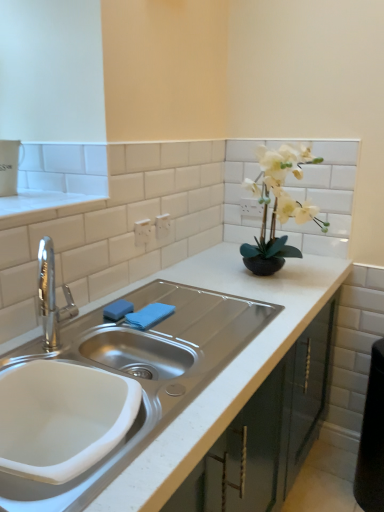
The image size is (384, 512). What do you see at coordinates (279, 207) in the screenshot?
I see `white matte vase at upper right` at bounding box center [279, 207].

Image resolution: width=384 pixels, height=512 pixels. What do you see at coordinates (149, 315) in the screenshot?
I see `blue fabric towel at sink` at bounding box center [149, 315].

Where is `white ceramic sink at lower left`? This screenshot has width=384, height=512. white ceramic sink at lower left is located at coordinates (62, 418).

Where is `white matte vase at upper right`? Image resolution: width=384 pixels, height=512 pixels. white matte vase at upper right is located at coordinates (279, 207).

Can you tell me how much blue sponge at sink and white ceramic sink at lower left differ in facing direction?

There is a 7-degree angle between the facing directions of blue sponge at sink and white ceramic sink at lower left.

Looking at this image, from the image's perspective, which is below, blue sponge at sink or white ceramic sink at lower left?

white ceramic sink at lower left appears lower in the image.

In the scene shown: Would you say blue sponge at sink is a long distance from white ceramic sink at lower left?

No, there isn't a large distance between blue sponge at sink and white ceramic sink at lower left.

Is blue sponge at sink not within white ceramic sink at lower left?

Indeed, blue sponge at sink is completely outside white ceramic sink at lower left.

Is blue fabric towel at sink in contact with white matte vase at upper right?

There is a gap between blue fabric towel at sink and white matte vase at upper right.

Who is smaller, blue fabric towel at sink or white matte vase at upper right?

blue fabric towel at sink is smaller.

Is blue fabric towel at sink situated inside white matte vase at upper right or outside?

blue fabric towel at sink is not inside white matte vase at upper right, it's outside.

Based on the photo, considering the relative positions of blue fabric towel at sink and white matte vase at upper right in the image provided, is blue fabric towel at sink to the right of white matte vase at upper right from the viewer's perspective?

In fact, blue fabric towel at sink is to the left of white matte vase at upper right.

From a real-world perspective, who is located higher, white matte countertop at center or white ceramic sink at lower left?

A: white matte countertop at center.

Locate an element on the screen. This screenshot has height=512, width=384. countertop above the white ceramic sink at lower left (from the image's perspective) is located at coordinates (224, 369).

Which is more to the left, white matte countertop at center or white ceramic sink at lower left?

From the viewer's perspective, white ceramic sink at lower left appears more on the left side.

Based on the photo, is white matte countertop at center looking in the opposite direction of white ceramic sink at lower left?

Yes, white matte countertop at center is facing away from white ceramic sink at lower left.

Is white matte vase at upper right with blue sponge at sink?

No, white matte vase at upper right is not beside blue sponge at sink.

The width and height of the screenshot is (384, 512). I want to click on houseplant that appears in front of the blue sponge at sink, so click(279, 207).

Measure the distance between white matte vase at upper right and blue sponge at sink.

white matte vase at upper right is 25.49 inches from blue sponge at sink.

Is white matte vase at upper right to the right of blue sponge at sink from the viewer's perspective?

Indeed, white matte vase at upper right is positioned on the right side of blue sponge at sink.

Can you tell me how much white matte vase at upper right and white matte countertop at center differ in facing direction?

They differ by 40.7 degrees in their facing directions.

This screenshot has height=512, width=384. In order to click on houseplant above the white matte countertop at center (from a real-world perspective) in this screenshot , I will do `click(279, 207)`.

Considering the relative positions of white matte vase at upper right and white matte countertop at center in the image provided, is white matte vase at upper right to the right of white matte countertop at center from the viewer's perspective?

Correct, you'll find white matte vase at upper right to the right of white matte countertop at center.

Would you say white matte vase at upper right contains white matte countertop at center?

No, white matte countertop at center is not surrounded by white matte vase at upper right.

Considering their positions, is blue sponge at sink located in front of or behind white matte vase at upper right?

blue sponge at sink is behind white matte vase at upper right.

Is blue sponge at sink shorter than white matte vase at upper right?

Yes, blue sponge at sink is shorter than white matte vase at upper right.

From a real-world perspective, which object stands above the other?

white matte vase at upper right, from a real-world perspective.

Can you confirm if white matte countertop at center is wider than blue sponge at sink?

Yes.

Can you tell me how much white matte countertop at center and blue sponge at sink differ in facing direction?

There is a 0.00199-degree angle between the facing directions of white matte countertop at center and blue sponge at sink.

From the image's perspective, is white matte countertop at center above blue sponge at sink?

No.

Identify the location of sink below the blue sponge at sink (from a real-world perspective). This screenshot has width=384, height=512. (62, 418).

You are a GUI agent. You are given a task and a screenshot of the screen. Output one action in this format:
    pyautogui.click(x=<x>, y=<y>)
    Task: Click on the towel bar that appears below the white matte vase at upper right (from the image's perspective)
    Image resolution: width=384 pixels, height=512 pixels.
    Given the screenshot: What is the action you would take?
    pyautogui.click(x=149, y=315)

Estimate the real-world distances between objects in this image. Which object is further from white ceramic sink at lower left, white matte countertop at center or white matte vase at upper right?

white matte vase at upper right is positioned further to the anchor white ceramic sink at lower left.

Looking at the image, which one is located further to white matte vase at upper right, blue fabric towel at sink or white ceramic sink at lower left?

white ceramic sink at lower left.

Which object lies further to the anchor point white matte countertop at center, white matte vase at upper right or blue fabric towel at sink?

blue fabric towel at sink lies further to white matte countertop at center than the other object.

Based on their spatial positions, is white matte vase at upper right or blue fabric towel at sink closer to blue sponge at sink?

The object closer to blue sponge at sink is blue fabric towel at sink.

Which object lies nearer to the anchor point blue sponge at sink, white ceramic sink at lower left or blue fabric towel at sink?

The object closer to blue sponge at sink is blue fabric towel at sink.

Which object lies further to the anchor point white matte countertop at center, white matte vase at upper right or white ceramic sink at lower left?

The object further to white matte countertop at center is white ceramic sink at lower left.

From the image, which object appears to be nearer to white matte vase at upper right, white matte countertop at center or blue sponge at sink?

white matte countertop at center.

Estimate the real-world distances between objects in this image. Which object is further from white ceramic sink at lower left, white matte vase at upper right or blue fabric towel at sink?

Among the two, white matte vase at upper right is located further to white ceramic sink at lower left.

Where is `sink between white matte countertop at center and blue fabric towel at sink along the z-axis`? Image resolution: width=384 pixels, height=512 pixels. sink between white matte countertop at center and blue fabric towel at sink along the z-axis is located at coordinates (62, 418).

This screenshot has width=384, height=512. In order to click on sink between white matte countertop at center and blue sponge at sink along the z-axis in this screenshot , I will do `click(62, 418)`.

Find the location of a particular element. The image size is (384, 512). towel bar between white matte countertop at center and blue sponge at sink in the front-back direction is located at coordinates (149, 315).

This screenshot has height=512, width=384. Find the location of `towel bar located between white matte countertop at center and white matte vase at upper right in the depth direction`. towel bar located between white matte countertop at center and white matte vase at upper right in the depth direction is located at coordinates (149, 315).